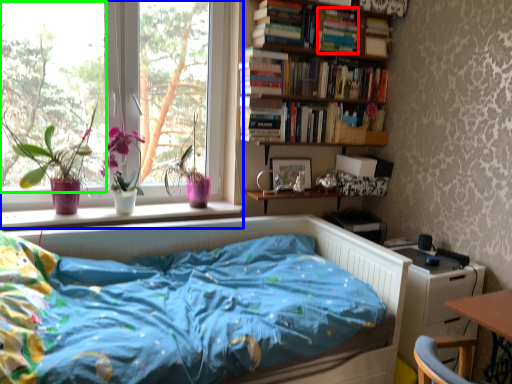
Question: Which object is positioned closest to book (highlighted by a red box)? Select from window (highlighted by a blue box) and window screen (highlighted by a green box).

Choices:
 (A) window
 (B) window screen

Answer: (A)